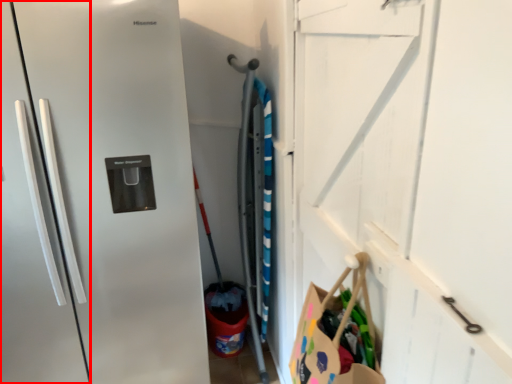
Question: From the image's perspective, where is door (annotated by the red box) located in relation to garage door in the image?

Choices:
 (A) below
 (B) above

Answer: (A)